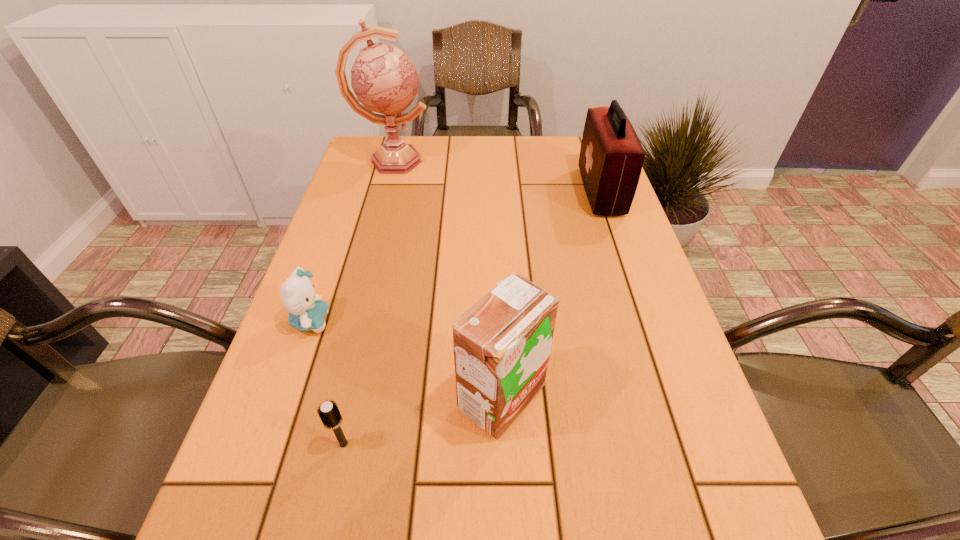
Locate an element on the screen. empty space that is in between the first aid kit and the tallest object is located at coordinates (497, 177).

Where is `object that is the fourth nearest to the tallest object`? The height and width of the screenshot is (540, 960). object that is the fourth nearest to the tallest object is located at coordinates tap(329, 413).

Where is `object that is the closest to the third nearest object`? This screenshot has height=540, width=960. object that is the closest to the third nearest object is located at coordinates (329, 413).

I want to click on free point that satisfies the following two spatial constraints: 1. on the front-facing side of the globe; 2. on the back side of the hairbrush, so click(318, 444).

You are a GUI agent. You are given a task and a screenshot of the screen. Output one action in this format:
    pyautogui.click(x=<x>, y=<y>)
    Task: Click on the vacant area that satisfies the following two spatial constraints: 1. on the front-facing side of the hairbrush; 2. on the left side of the globe
    
    Given the screenshot: What is the action you would take?
    pyautogui.click(x=318, y=444)